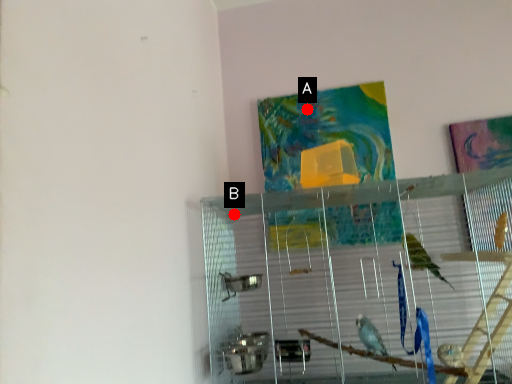
Question: Two points are circled on the image, labeled by A and B beside each circle. Which point is further to the camera?

Choices:
 (A) A is further
 (B) B is further

Answer: (A)